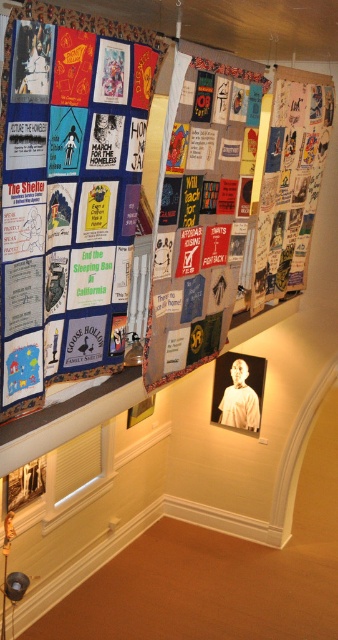
Can you confirm if textile collage at upper left is bigger than white matte portrait at center?

Indeed, textile collage at upper left has a larger size compared to white matte portrait at center.

Locate an element on the screen. The image size is (338, 640). textile collage at upper left is located at coordinates (68, 195).

Does textile collage at upper left have a greater height compared to textured fabric posters at upper right?

Incorrect, textile collage at upper left's height is not larger of textured fabric posters at upper right's.

I want to click on textile collage at upper left, so click(x=68, y=195).

Is textile collage at upper center to the right of white matte portrait at center from the viewer's perspective?

In fact, textile collage at upper center is to the left of white matte portrait at center.

Who is more forward, (x=183, y=188) or (x=221, y=355)?

Point (x=183, y=188)

In order to click on textile collage at upper center in this screenshot , I will do `click(199, 212)`.

Identify the location of textile collage at upper center. Image resolution: width=338 pixels, height=640 pixels. (199, 212).